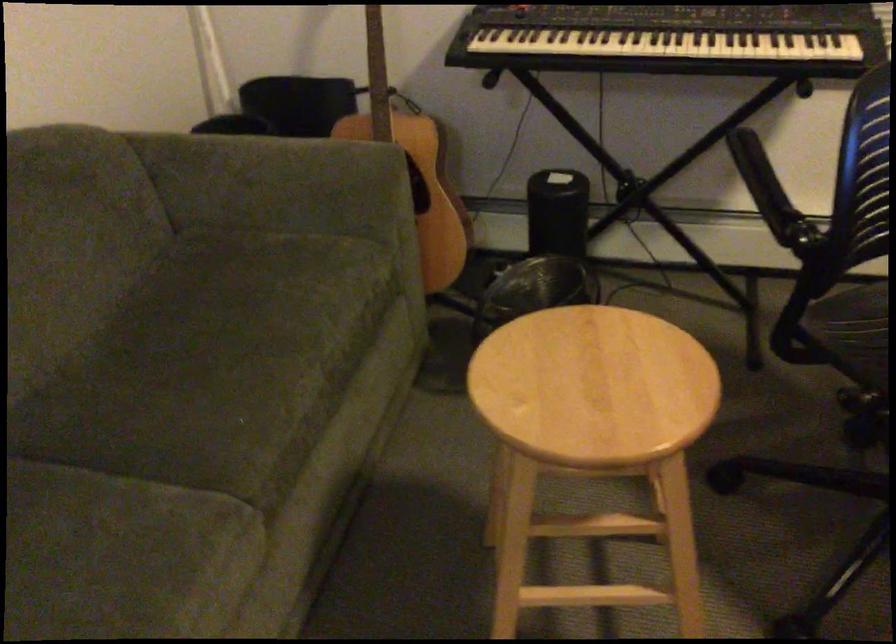
What do you see at coordinates (667, 44) in the screenshot? I see `the keyboard keys` at bounding box center [667, 44].